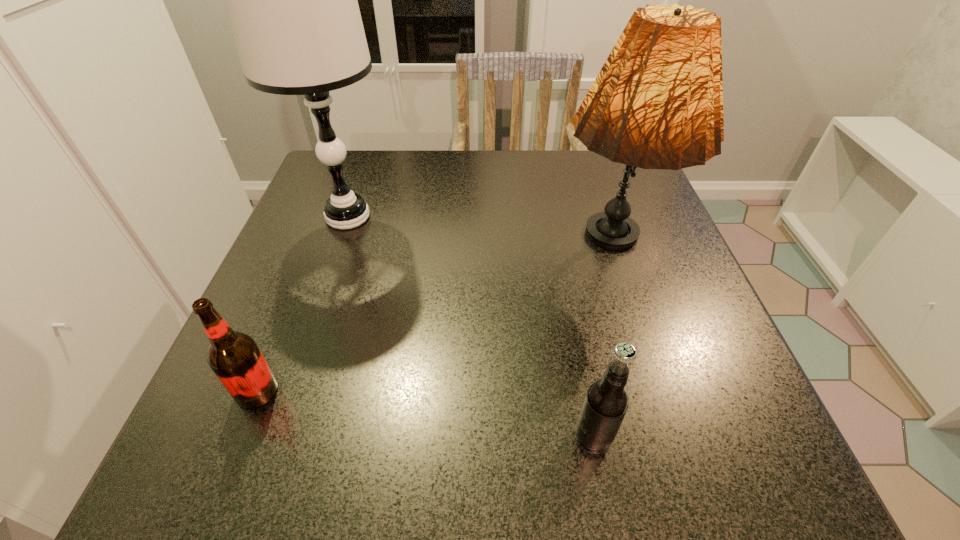
At what (x,y) coordinates should I click in order to perform the action: click on table lamp. Please return your answer as a coordinate pair (x, y). The image size is (960, 540). Looking at the image, I should click on (x=291, y=0).

Locate an element on the screen. lampshade is located at coordinates (657, 103).

Where is `the nearer root beer`? This screenshot has height=540, width=960. the nearer root beer is located at coordinates (606, 402).

Locate an element on the screen. This screenshot has height=540, width=960. the nearest object is located at coordinates (606, 402).

The image size is (960, 540). In order to click on the left root beer in this screenshot , I will do `click(234, 357)`.

This screenshot has height=540, width=960. Find the location of `the farther root beer`. the farther root beer is located at coordinates point(234,357).

What are the coordinates of `vacant space situated 0.270m on the right of the table lamp` in the screenshot? It's located at (517, 217).

The image size is (960, 540). I want to click on vacant area situated 0.300m on the front-facing side of the lampshade, so click(x=674, y=480).

The image size is (960, 540). What are the coordinates of `free space located 0.400m on the label of the nearest object` in the screenshot? It's located at (289, 437).

At what (x,y) coordinates should I click in order to perform the action: click on vacant space situated on the label of the nearest object. Please return your answer as a coordinate pair (x, y). Looking at the image, I should click on (495, 437).